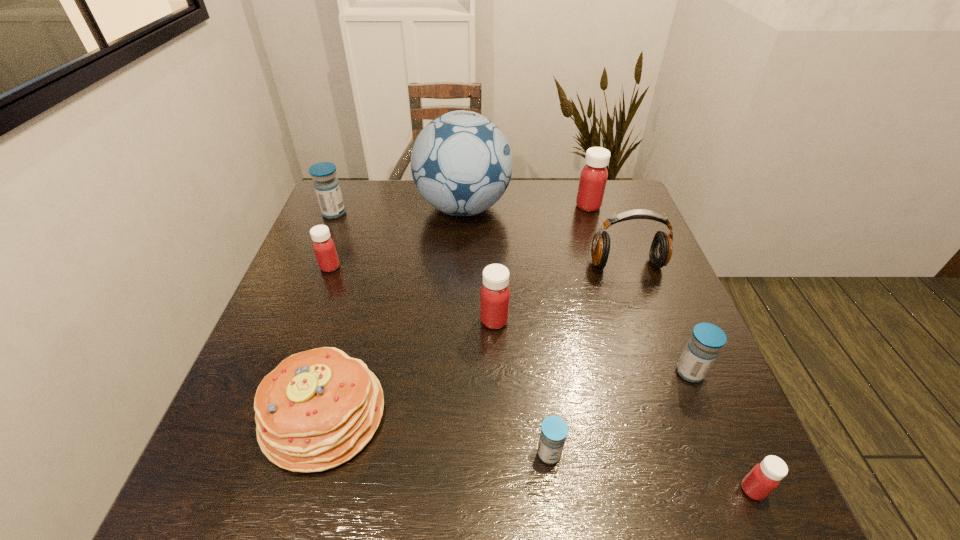
Locate an element on the screen. This screenshot has width=960, height=540. blank area in the image that satisfies the following two spatial constraints: 1. on the front side of the third smallest red medicine; 2. on the left side of the biggest blue medicine is located at coordinates (289, 321).

Identify the location of vacant area in the image that satisfies the following two spatial constraints: 1. on the front side of the second biggest red medicine; 2. on the left side of the rightmost blue medicine. The width and height of the screenshot is (960, 540). click(x=496, y=372).